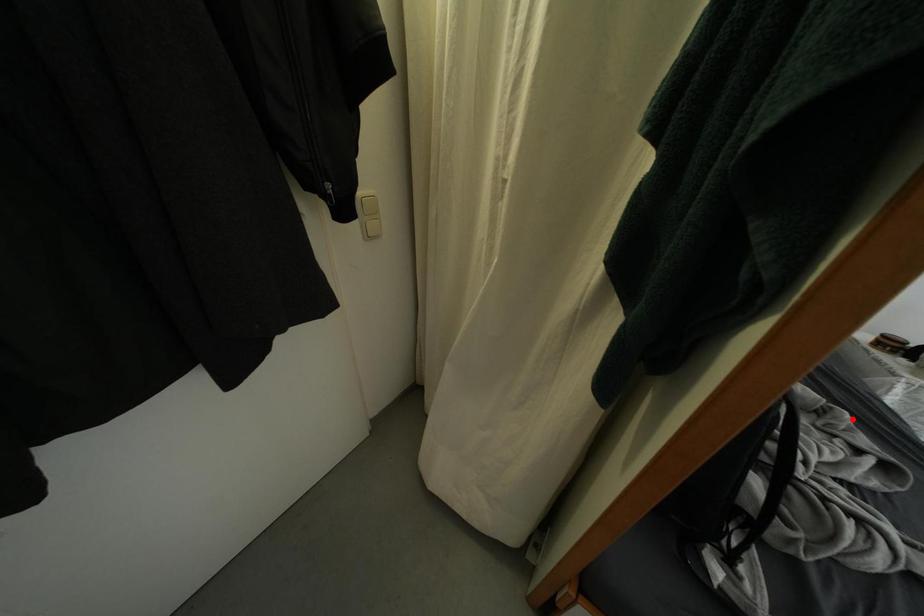
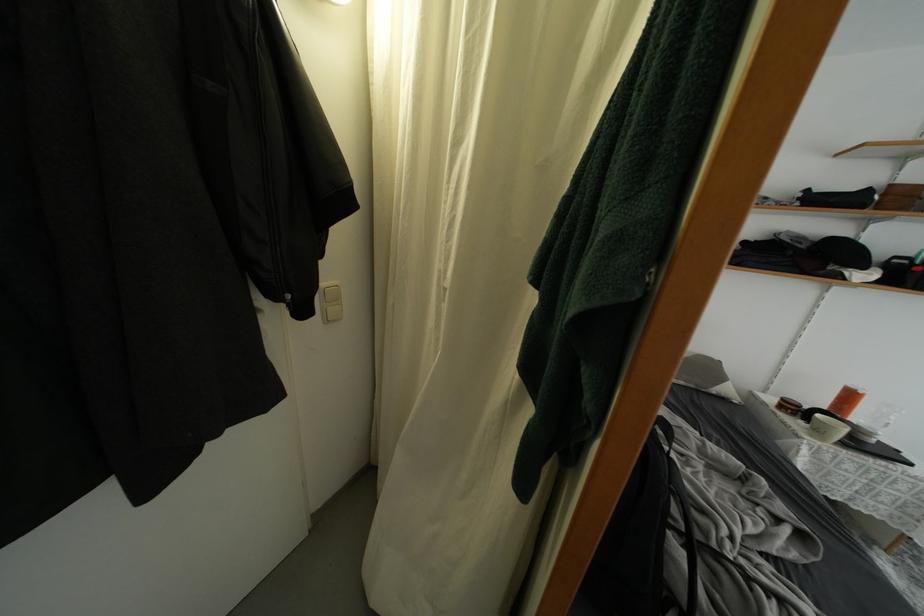
Find the pixel in the second image that matches the highlighted location in the first image.

(769, 485)